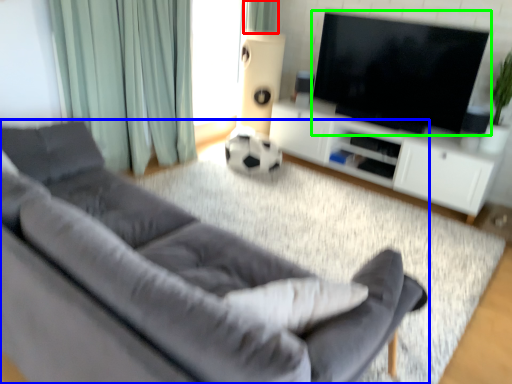
Question: Estimate the real-world distances between objects in this image. Which object is farther from curtain (highlighted by a red box), studio couch (highlighted by a blue box) or television (highlighted by a green box)?

Choices:
 (A) studio couch
 (B) television

Answer: (A)